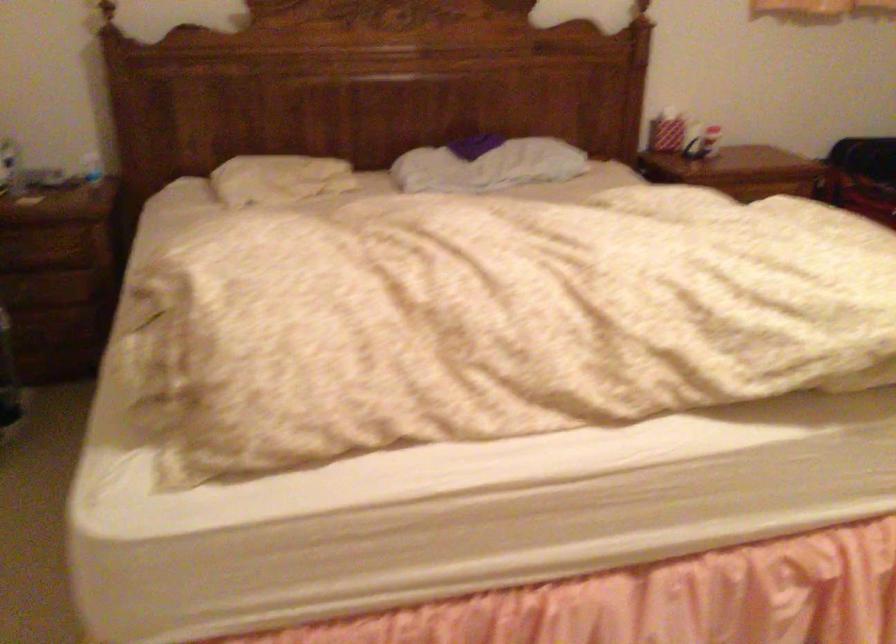
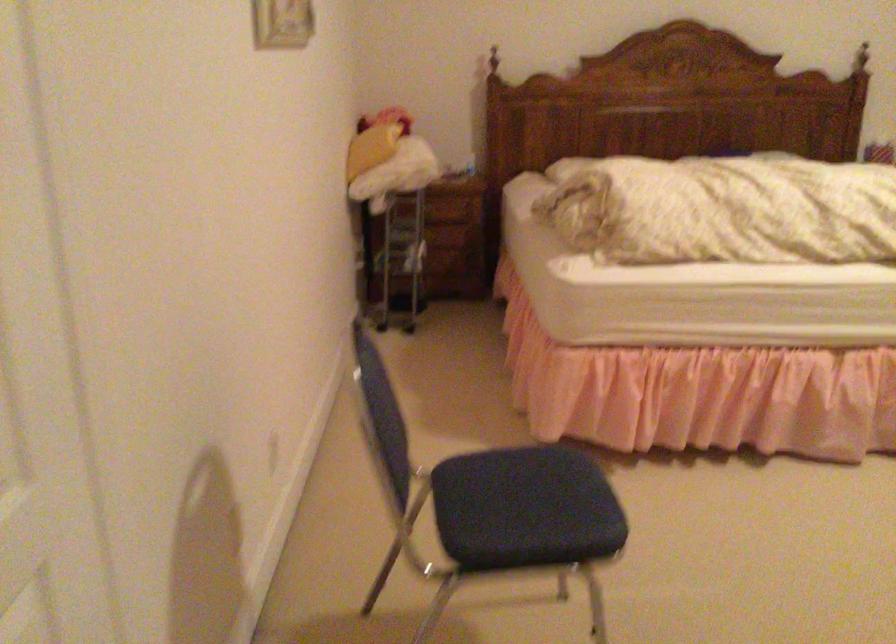
Question: Which direction would the cameraman need to move to produce the second image? Reply with the corresponding letter.

Choices:
 (A) Left
 (B) Right
 (C) Forward
 (D) Backward

Answer: (D)